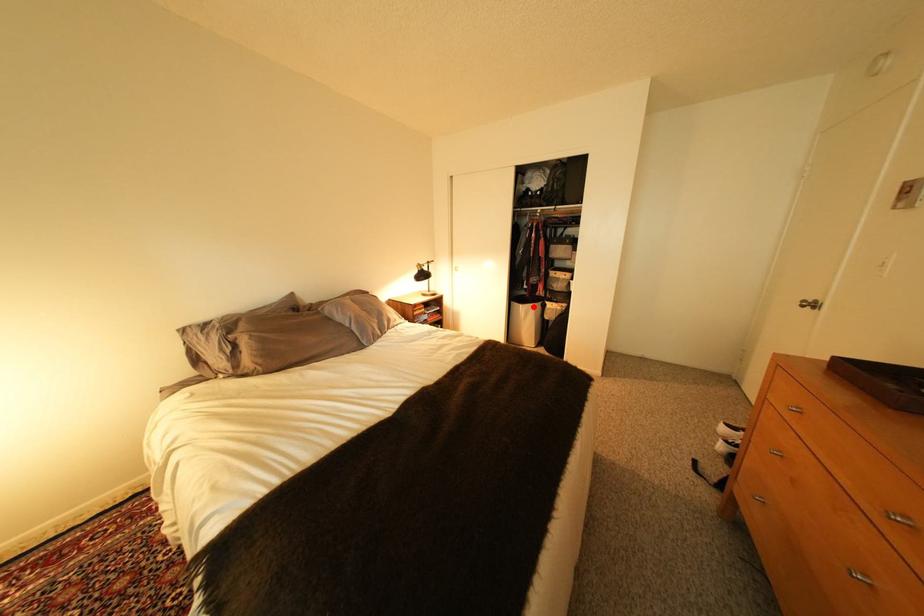
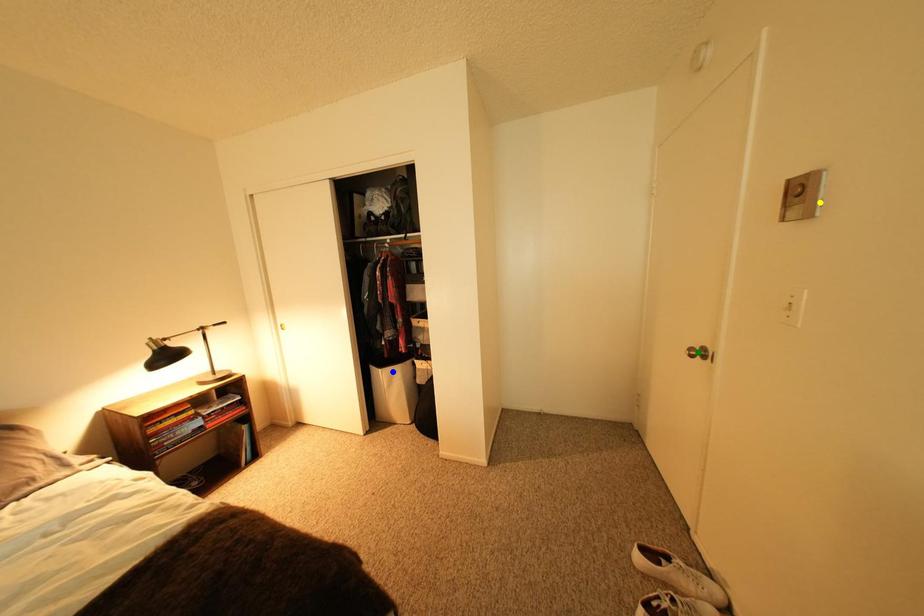
Question: I am providing you with two images of the same scene from different viewpoints. A red point is marked on the first image. You are given multiple points on the second image. Which spot in image 2 lines up with the point in image 1?

Choices:
 (A) yellow point
 (B) green point
 (C) blue point

Answer: (C)